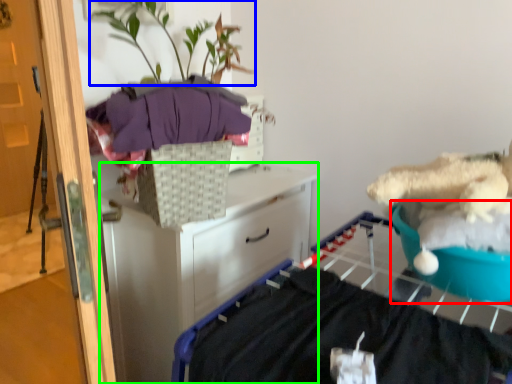
Question: Based on their relative distances, which object is nearer to teal (highlighted by a red box)? Choose from plant (highlighted by a blue box) and chest of drawers (highlighted by a green box).

Choices:
 (A) plant
 (B) chest of drawers

Answer: (B)